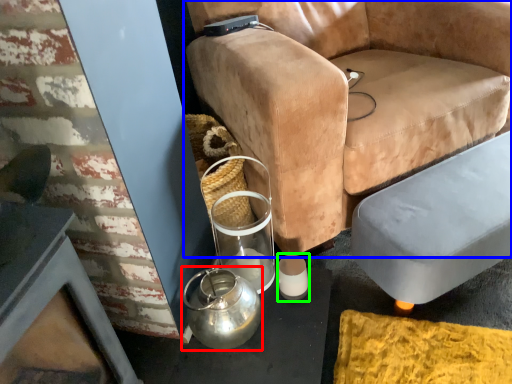
Question: Which object is the closest to the tea pot (highlighted by a red box)? Choose among these: chair (highlighted by a blue box) or candle holder (highlighted by a green box).

Choices:
 (A) chair
 (B) candle holder

Answer: (B)